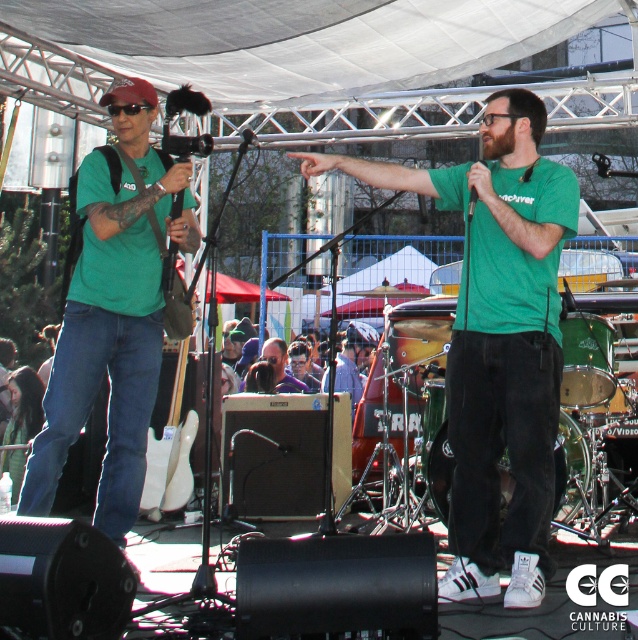
You are standing at the point with coordinates point (94, 285) and want to move towards the point with coordinates point (526, 460). Which direction should you move?

You should move towards the point (526, 460) because it is closer to you than the point (94, 285).